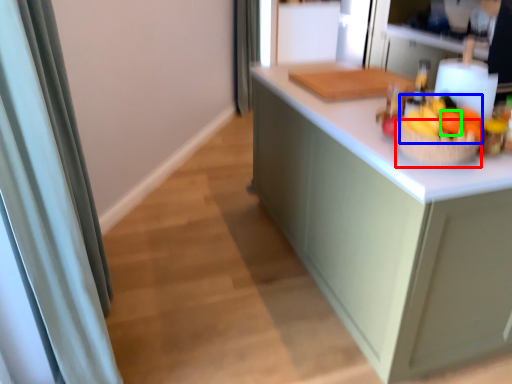
Question: Considering the real-world distances, which object is closest to basket (highlighted by a red box)? fruit (highlighted by a blue box) or orange (highlighted by a green box).

Choices:
 (A) fruit
 (B) orange

Answer: (A)